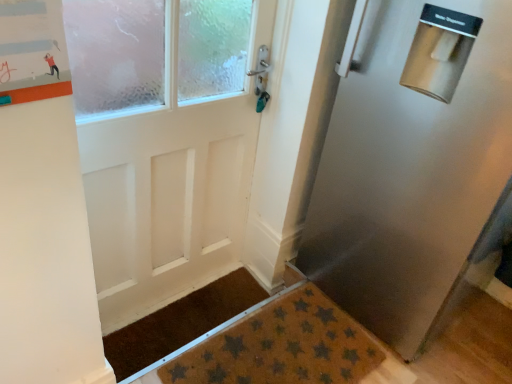
Identify the location of free space above brown textured mat at lower center, which appears as the 1th doormat when viewed from the back (from a real-world perspective). This screenshot has height=384, width=512. (187, 315).